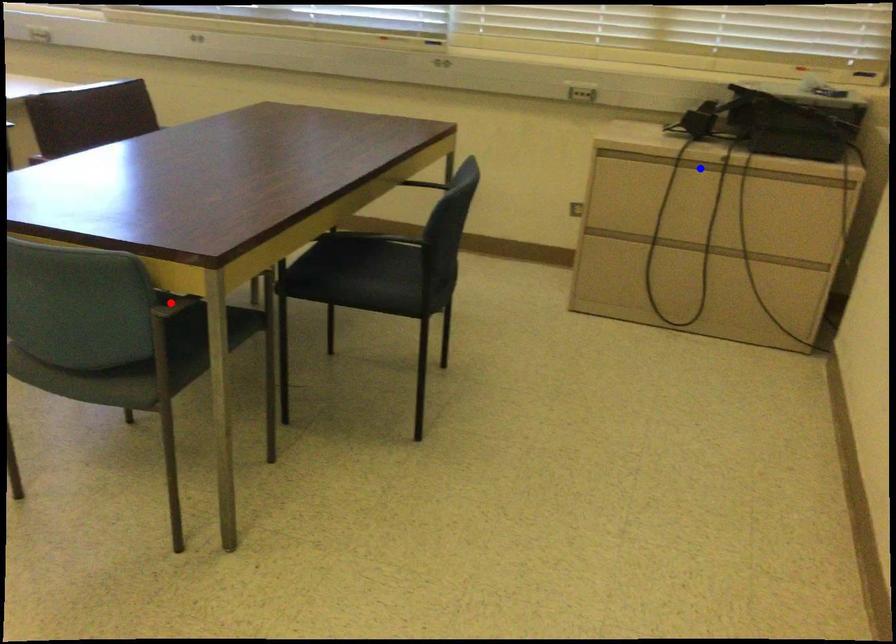
Question: Two points are marked on the image. Which point is closer to the camera?

Choices:
 (A) Blue point is closer.
 (B) Red point is closer.

Answer: (B)